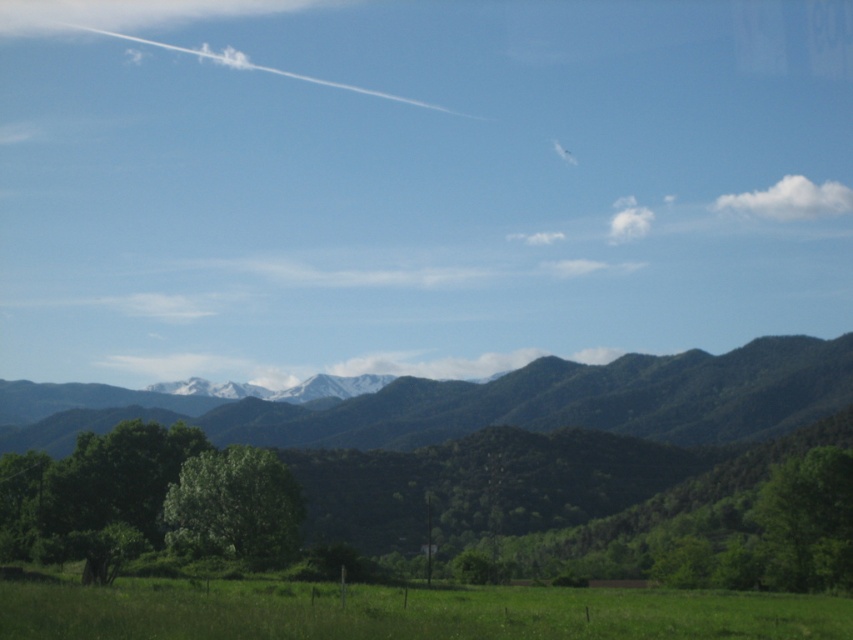
You are standing in the middle of the green grassy field at lower center and want to walk towards the green leafy forest at center. Which direction should you head?

The green leafy forest at center is located below the green grassy field at lower center, so you should head downward to reach it.

You are standing in the grassy field and want to walk towards both the point at coordinates point (693, 412) and the point at coordinates point (616, 632). Which point will you reach first?

You will reach the point at coordinates point (693, 412) first because it is closer to you than the point at coordinates point (616, 632), which is further away.